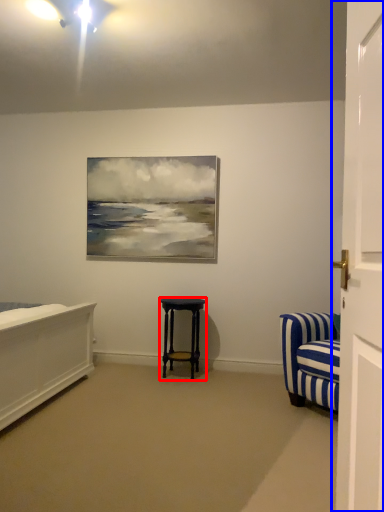
Question: Among these objects, which one is farthest to the camera, stool (highlighted by a red box) or door (highlighted by a blue box)?

Choices:
 (A) stool
 (B) door

Answer: (A)